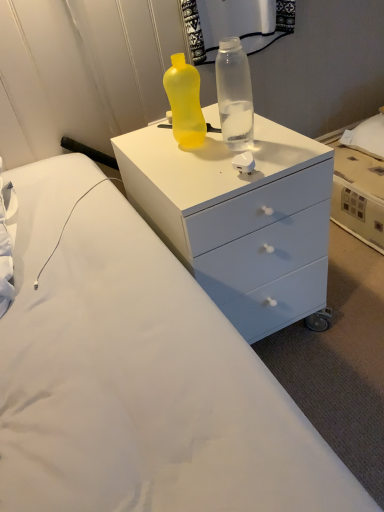
Locate an element on the screen. Image resolution: width=384 pixels, height=512 pixels. white matte chest of drawers at center is located at coordinates (239, 219).

What do you see at coordinates (239, 219) in the screenshot? I see `white matte chest of drawers at center` at bounding box center [239, 219].

Find the location of a particular element. This screenshot has width=384, height=512. white matte chest of drawers at center is located at coordinates (239, 219).